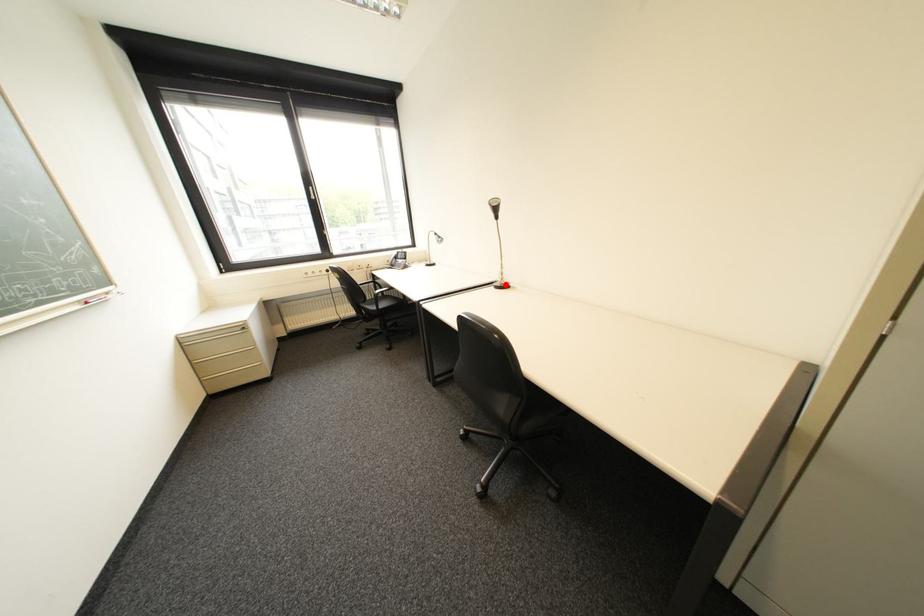
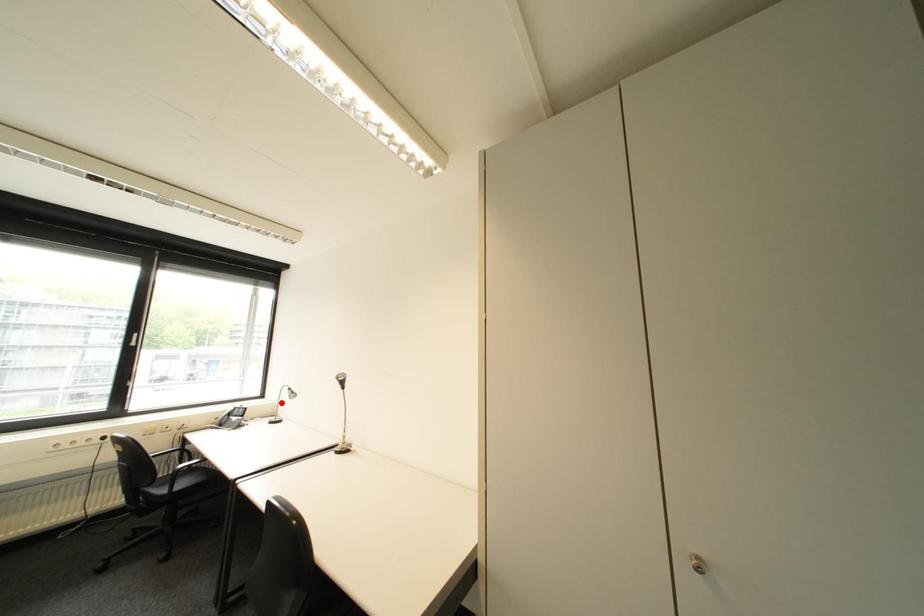
I am providing you with two images of the same scene from different viewpoints. A red point is marked on the first image and another point is marked on the second image. Is the red point in image1 aligned with the point shown in image2?

No